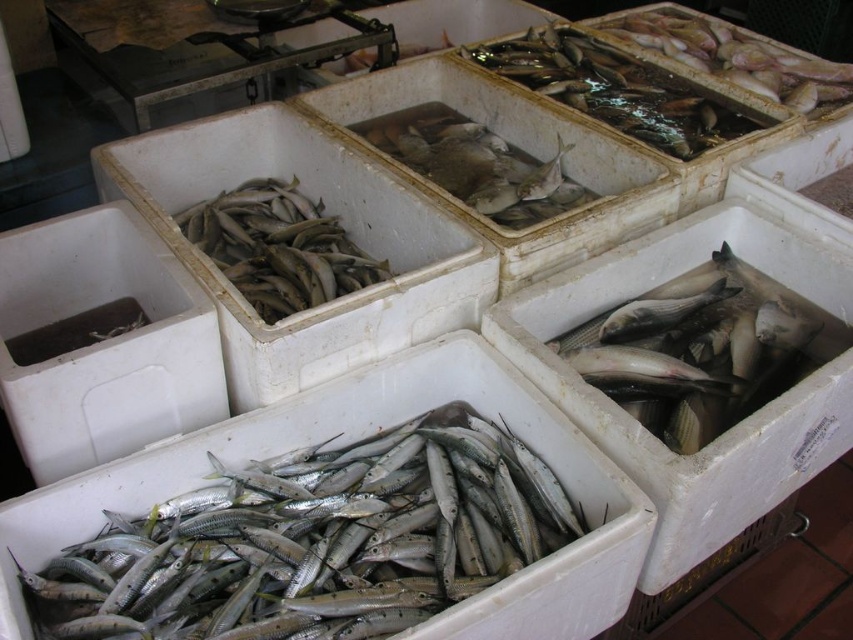
You are standing at the fish market and see the white plastic containers arranged in a grid. You notice a point marked at coordinates (450, 150). Which container does this point belong to?

The point at (450, 150) is on the silvery fish at center, so it belongs to the container holding silvery fish at the center.

You are standing at the fish market and want to pick up the item closest to you between the two points marked as point (601,387) and point (637,90). Which point should you approach?

You should approach point (601,387) because it is closer to the viewer than point (637,90).

What is the color of the fish located at point [619,90] in the image?

The fish at point [619,90] is shiny silver.